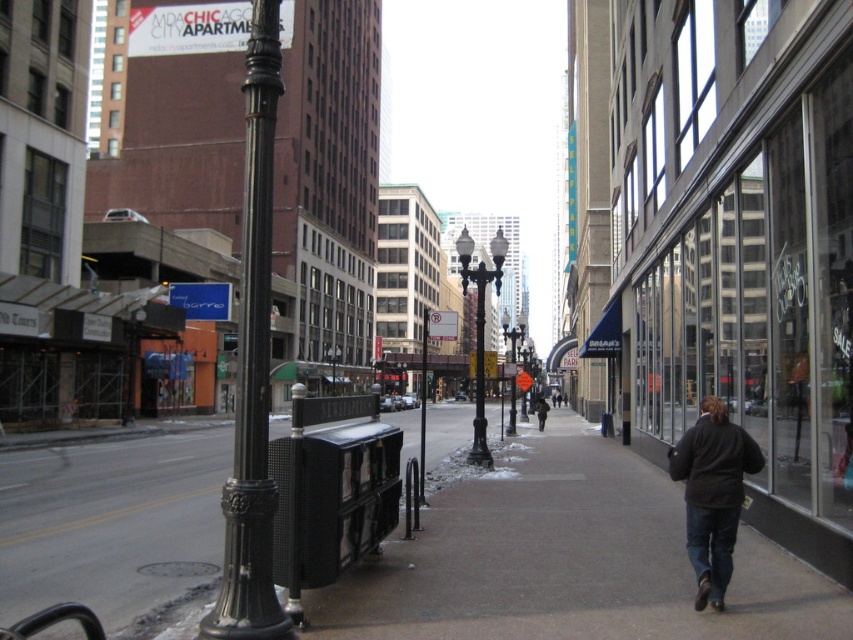
You are a city planner reviewing a map of the urban street scene. The map shows a point labeled as point (514, 337). What does this point represent?

The point (514, 337) indicates the location of the polished bronze streetlight at center.

You are a delivery person trying to navigate through the snowy street. You see the black cast iron pole at left and the black polished metal streetlight at center. Which object is closer to the ground?

The black cast iron pole at left is below the black polished metal streetlight at center, so it is closer to the ground.

You are a delivery person trying to deliver a package to the polished bronze streetlight at center. However, there is a brown fuzzy coat at center in the way. Can you reach the streetlight without moving the coat?

The polished bronze streetlight at center is in front of the brown fuzzy coat at center, so you can reach the streetlight without moving the coat since it is already in front.